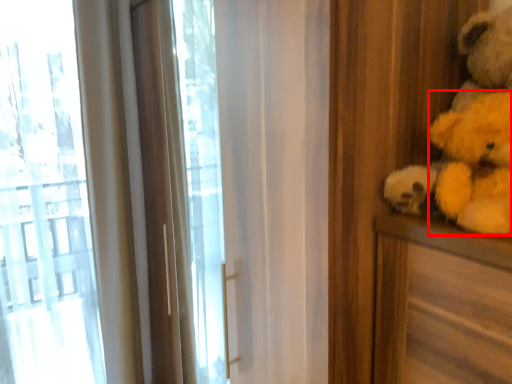
Question: From the image's perspective, considering the relative positions of animal (annotated by the red box) and teddy bear in the image provided, where is animal (annotated by the red box) located with respect to the staircase?

Choices:
 (A) below
 (B) above

Answer: (A)